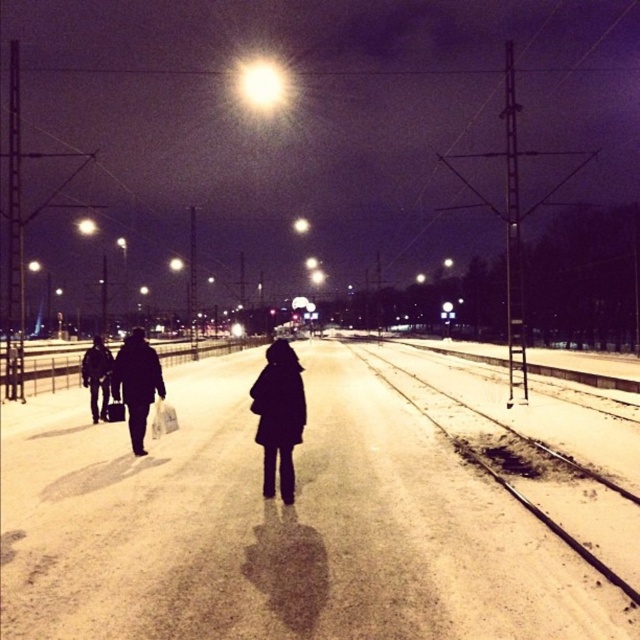
Question: Among these objects, which one is farthest from the camera?

Choices:
 (A) smooth concrete train track at center
 (B) dark matte coat at left
 (C) dark matte coat at center

Answer: (B)

Question: Is black matte coat at center above dark matte coat at center?

Choices:
 (A) no
 (B) yes

Answer: (A)

Question: Which is nearer to the black matte coat at center?

Choices:
 (A) smooth concrete train track at center
 (B) dark matte coat at center
 (C) dark matte coat at left

Answer: (B)

Question: Which point is closer to the camera?

Choices:
 (A) (580, 477)
 (B) (90, 364)
 (C) (134, 433)

Answer: (A)

Question: Is smooth concrete train track at center above black matte coat at center?

Choices:
 (A) no
 (B) yes

Answer: (A)

Question: Does smooth concrete train track at center appear over dark matte coat at center?

Choices:
 (A) no
 (B) yes

Answer: (A)